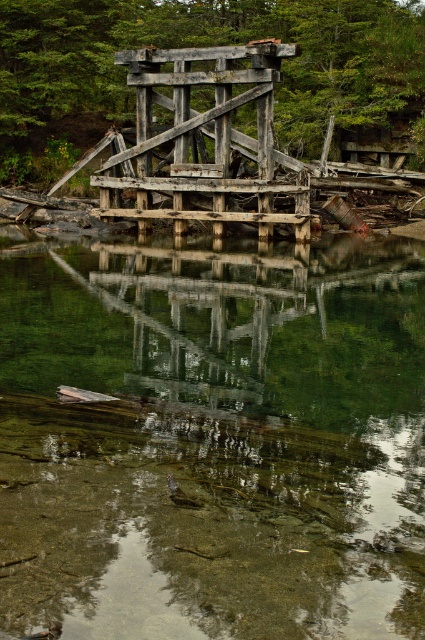
Question: Is clear glass water at center further to camera compared to weathered wood bridge at center?

Choices:
 (A) yes
 (B) no

Answer: (B)

Question: Is clear glass water at center bigger than rusty wooden bridge at center?

Choices:
 (A) no
 (B) yes

Answer: (A)

Question: Which is nearer to the weathered wood bridge at center?

Choices:
 (A) rusty wooden bridge at center
 (B) clear glass water at center
 (C) wooden bridge at center

Answer: (C)

Question: Which object is the farthest from the weathered wood bridge at center?

Choices:
 (A) clear glass water at center
 (B) rusty wooden bridge at center
 (C) wooden bridge at center

Answer: (B)

Question: Does rusty wooden bridge at center appear under weathered wood bridge at center?

Choices:
 (A) yes
 (B) no

Answer: (B)

Question: Estimate the real-world distances between objects in this image. Which object is farther from the wooden bridge at center?

Choices:
 (A) rusty wooden bridge at center
 (B) clear glass water at center

Answer: (A)